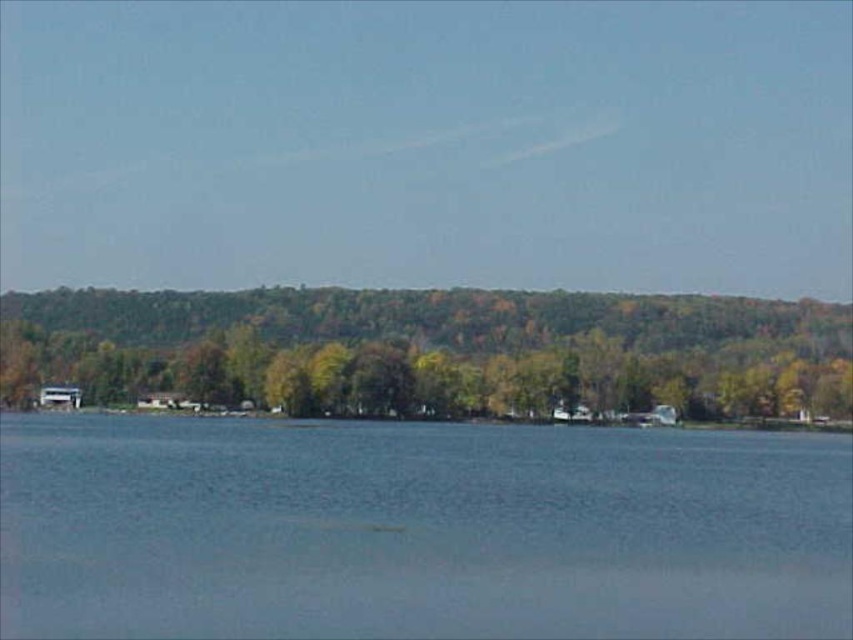
Is blue water at center positioned at the back of green leafy trees at center?

That is False.

Is point (433, 582) positioned after point (125, 339)?

No.

At what (x,y) coordinates should I click in order to perform the action: click on blue water at center. Please return your answer as a coordinate pair (x, y). The image size is (853, 640). Looking at the image, I should click on (418, 529).